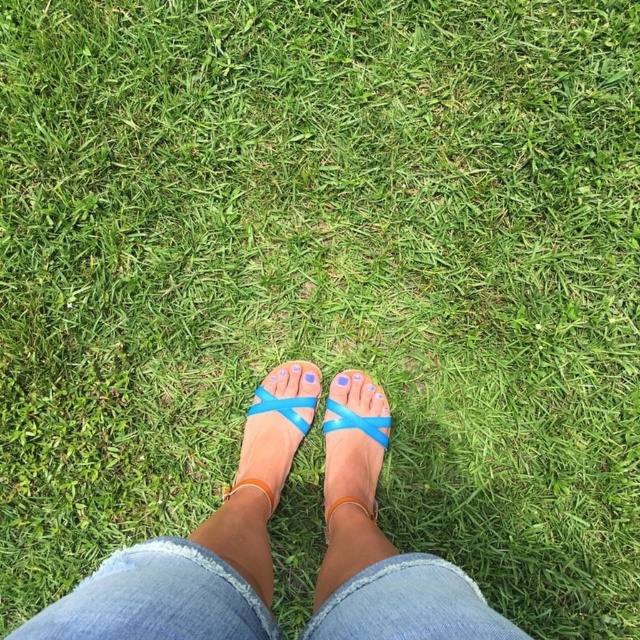
Between translucent plastic sandals at center and denim at center, which one has less height?

With less height is denim at center.

From the picture: Does translucent plastic sandals at center come in front of denim at center?

No.

Find the location of `translucent plastic sandals at center`. translucent plastic sandals at center is located at coordinates (202, 545).

Based on the photo, who is lower down, translucent plastic sandals at center or blue matte toe at center?

Positioned lower is translucent plastic sandals at center.

Does translucent plastic sandals at center appear on the left side of blue matte toe at center?

Correct, you'll find translucent plastic sandals at center to the left of blue matte toe at center.

Which is in front, point (404, 605) or point (333, 378)?

Point (404, 605) is in front.

Identify the location of translucent plastic sandals at center. tap(202, 545).

Who is positioned more to the right, denim at center or blue matte toe at center?

From the viewer's perspective, blue matte toe at center appears more on the right side.

Does point (132, 618) lie in front of point (340, 385)?

Yes, it is.

This screenshot has width=640, height=640. What are the coordinates of `denim at center` in the screenshot? It's located at (156, 600).

This screenshot has height=640, width=640. In order to click on denim at center in this screenshot , I will do `click(156, 600)`.